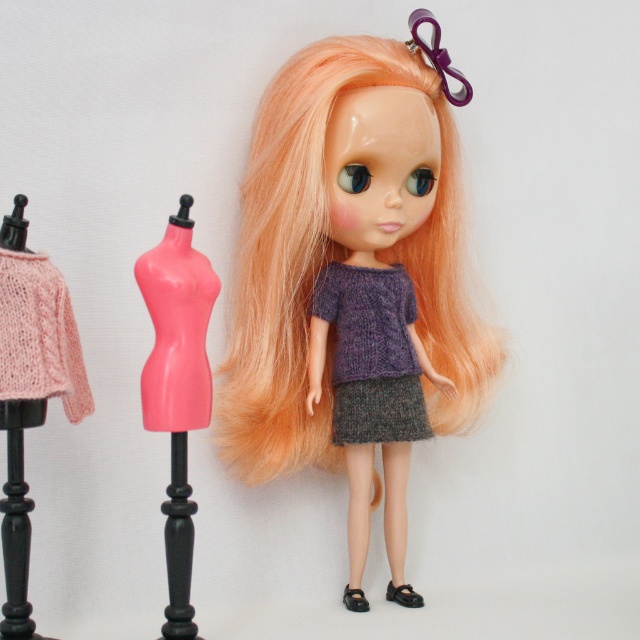
Can you confirm if knitted purple sweater at center is positioned to the left of pink plastic dress form at left?

Incorrect, knitted purple sweater at center is not on the left side of pink plastic dress form at left.

You are a GUI agent. You are given a task and a screenshot of the screen. Output one action in this format:
    pyautogui.click(x=<x>, y=<y>)
    Task: Click on the knitted purple sweater at center
    This screenshot has height=640, width=640.
    Given the screenshot: What is the action you would take?
    pyautogui.click(x=371, y=353)

Between point (333, 321) and point (209, 300), which one is positioned behind?

Positioned behind is point (333, 321).

Where is `knitted purple sweater at center`? The height and width of the screenshot is (640, 640). knitted purple sweater at center is located at coordinates (371, 353).

Does blonde silky hair at center appear over knitted purple sweater at center?

Yes, blonde silky hair at center is above knitted purple sweater at center.

From the picture: Measure the distance between blonde silky hair at center and camera.

blonde silky hair at center and camera are 4.08 feet apart from each other.

The height and width of the screenshot is (640, 640). Identify the location of blonde silky hair at center. (333, 259).

Who is lower down, blonde silky hair at center or pink plastic dress form at left?

pink plastic dress form at left

Does point (321, 406) come farther from viewer compared to point (166, 320)?

Yes, point (321, 406) is behind point (166, 320).

Which is behind, point (460, 292) or point (205, 260)?

The point (460, 292) is more distant.

Where is `blonde silky hair at center`? blonde silky hair at center is located at coordinates (333, 259).